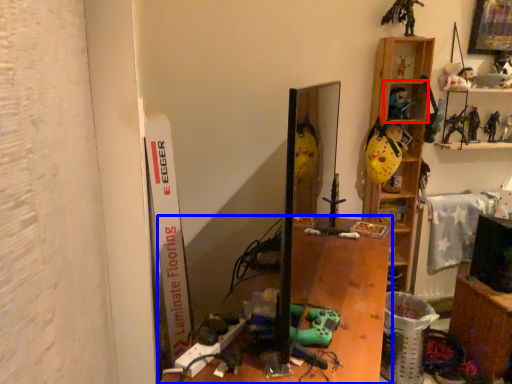
Question: Which object appears farthest to the camera in this image, shelf (highlighted by a red box) or furniture (highlighted by a blue box)?

Choices:
 (A) shelf
 (B) furniture

Answer: (A)